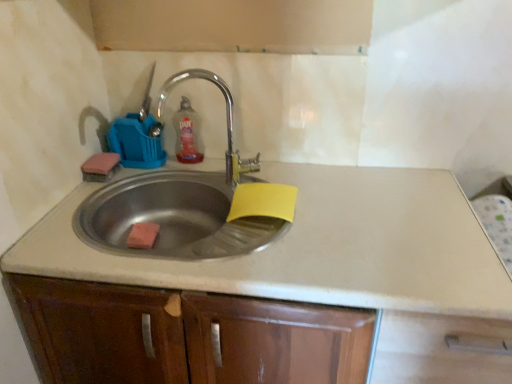
Find the location of `free space above beige laminate countertop at center (from a real-world perspective)`. free space above beige laminate countertop at center (from a real-world perspective) is located at coordinates (294, 196).